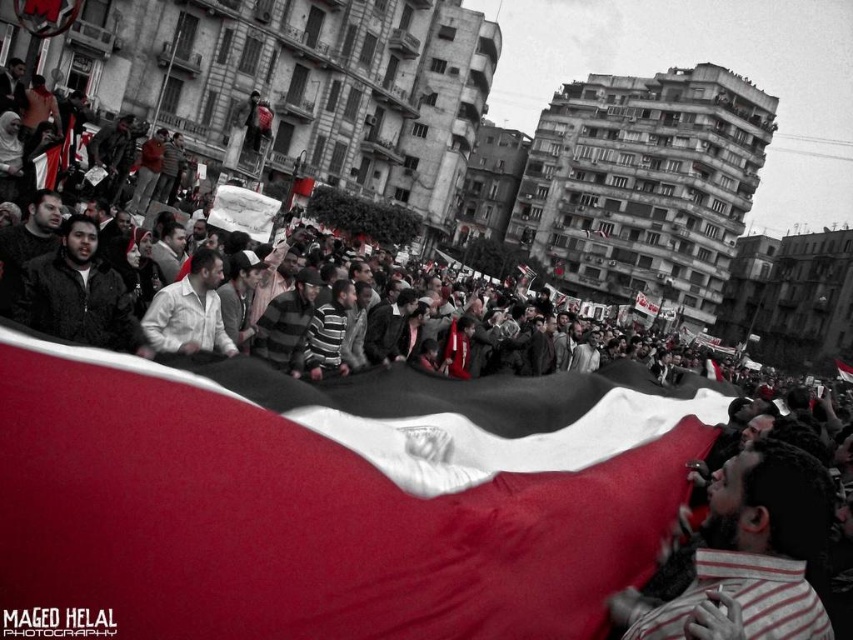
Question: Which point is farther to the camera?

Choices:
 (A) white matte shirt at center
 (B) striped shirt at lower right

Answer: (A)

Question: Which object is farther from the camera taking this photo?

Choices:
 (A) white matte shirt at center
 (B) striped shirt at lower right

Answer: (A)

Question: Does striped shirt at lower right come in front of white matte shirt at center?

Choices:
 (A) yes
 (B) no

Answer: (A)

Question: Is the position of striped shirt at lower right less distant than that of white matte shirt at center?

Choices:
 (A) no
 (B) yes

Answer: (B)

Question: Does striped shirt at lower right have a lesser width compared to white matte shirt at center?

Choices:
 (A) yes
 (B) no

Answer: (B)

Question: Which object is closer to the camera taking this photo?

Choices:
 (A) striped shirt at lower right
 (B) white matte shirt at center

Answer: (A)